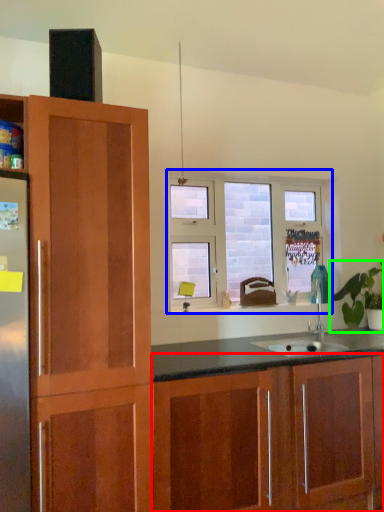
Question: Considering the real-world distances, which object is closest to cabinetry (highlighted by a red box)? window (highlighted by a blue box) or houseplant (highlighted by a green box).

Choices:
 (A) window
 (B) houseplant

Answer: (B)